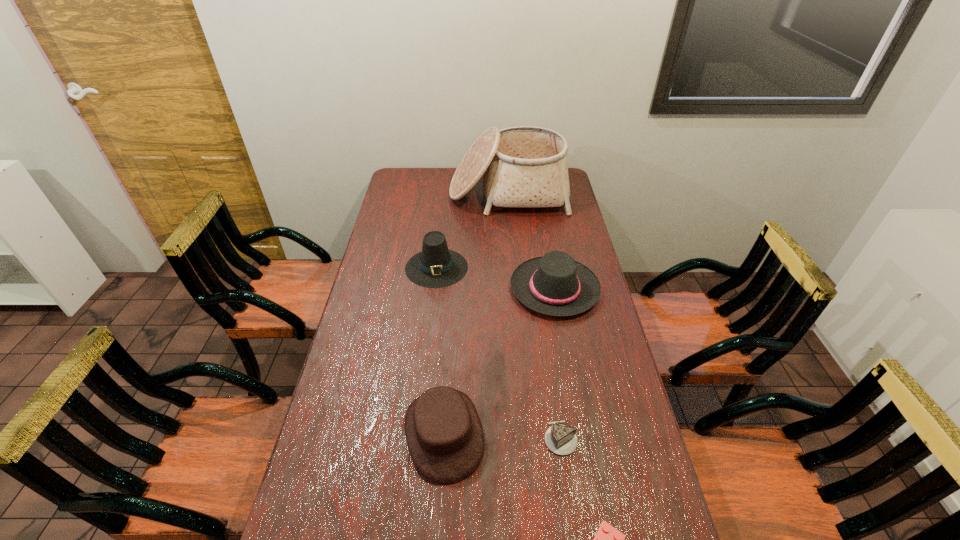
Where is `blank region between the tallest object and the chocolate cake`? This screenshot has height=540, width=960. blank region between the tallest object and the chocolate cake is located at coordinates (534, 316).

What are the coordinates of `free area in between the rightmost hat and the nearest hat` in the screenshot? It's located at (499, 361).

At what (x,y) coordinates should I click in order to perform the action: click on free area in between the nearest hat and the farthest object. Please return your answer as a coordinate pair (x, y). This screenshot has width=960, height=540. Looking at the image, I should click on (476, 313).

At what (x,y) coordinates should I click in order to perform the action: click on free space that is in between the rightmost hat and the fifth shortest object. Please return your answer as a coordinate pair (x, y). Looking at the image, I should click on (495, 278).

Locate an element on the screen. vacant area that lies between the chocolate cake and the rightmost hat is located at coordinates (558, 363).

This screenshot has height=540, width=960. What are the coordinates of `empty space between the basket and the nearest hat` in the screenshot? It's located at (476, 313).

Locate an element on the screen. object that is the second closest one to the nearest hat is located at coordinates (608, 539).

Find the location of a particular element. The image size is (960, 540). the fourth closest object to the second tallest object is located at coordinates (560, 439).

The height and width of the screenshot is (540, 960). I want to click on hat that is the second closest to the nearest hat, so click(x=436, y=266).

You are a GUI agent. You are given a task and a screenshot of the screen. Output one action in this format:
    pyautogui.click(x=<x>, y=<y>)
    Task: Click on the hat object that ranks as the closest to the fifth tallest object
    This screenshot has width=960, height=540.
    Given the screenshot: What is the action you would take?
    pyautogui.click(x=443, y=431)